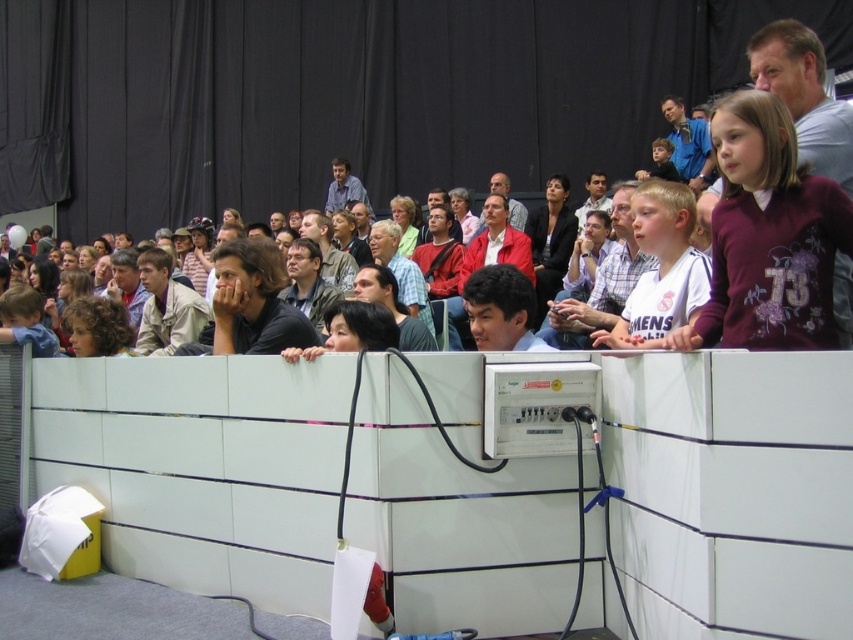
Question: Does dark gray shirt at center appear on the left side of light brown hair at center?

Choices:
 (A) yes
 (B) no

Answer: (A)

Question: Estimate the real-world distances between objects in this image. Which object is closer to the matte black jacket at upper center?

Choices:
 (A) maroon fleece jacket at upper right
 (B) dark gray shirt at center
 (C) khaki fabric jacket at left
 (D) light brown hair at center

Answer: (D)

Question: Based on their relative distances, which object is farther from the gray fabric jacket at center?

Choices:
 (A) matte black jacket at upper center
 (B) matte gray shirt at center

Answer: (B)

Question: Does dark gray shirt at center appear over matte black jacket at upper center?

Choices:
 (A) yes
 (B) no

Answer: (B)

Question: Which point appears closest to the camera in this image?

Choices:
 (A) (572, 243)
 (B) (167, 260)
 (C) (287, 289)
 (D) (651, 157)

Answer: (C)

Question: In this image, where is maroon fleece jacket at upper right located relative to curly hair at lower left?

Choices:
 (A) left
 (B) right

Answer: (B)